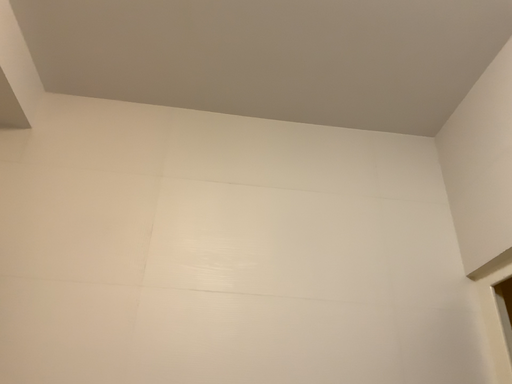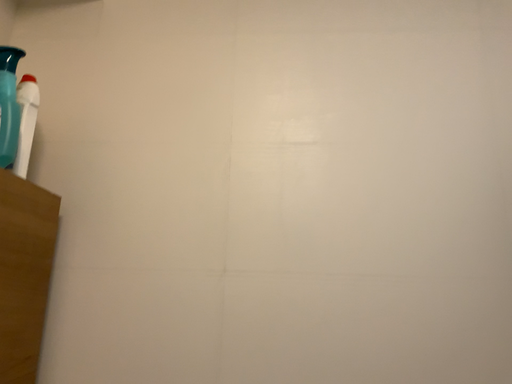
Question: How did the camera likely rotate when shooting the video?

Choices:
 (A) rotated upward
 (B) rotated downward

Answer: (B)